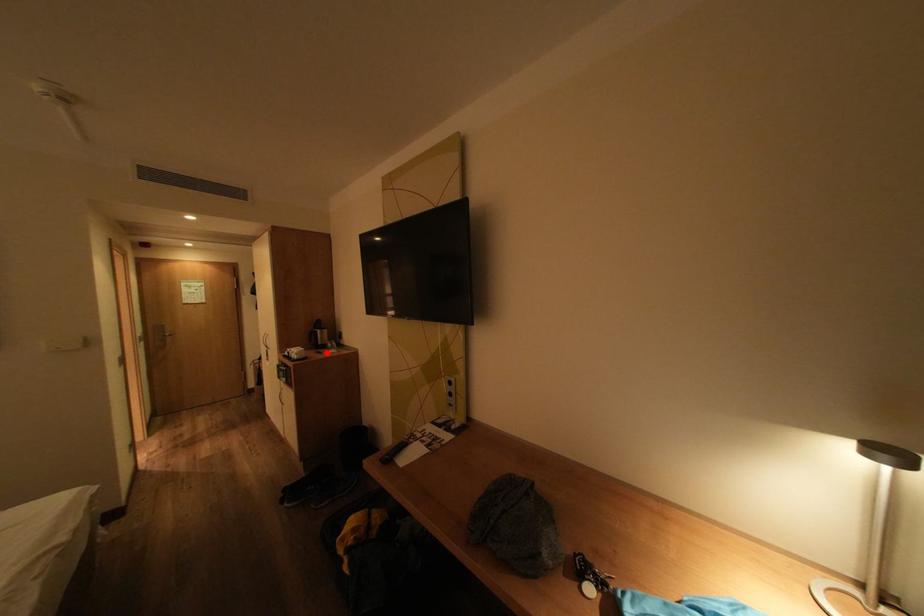
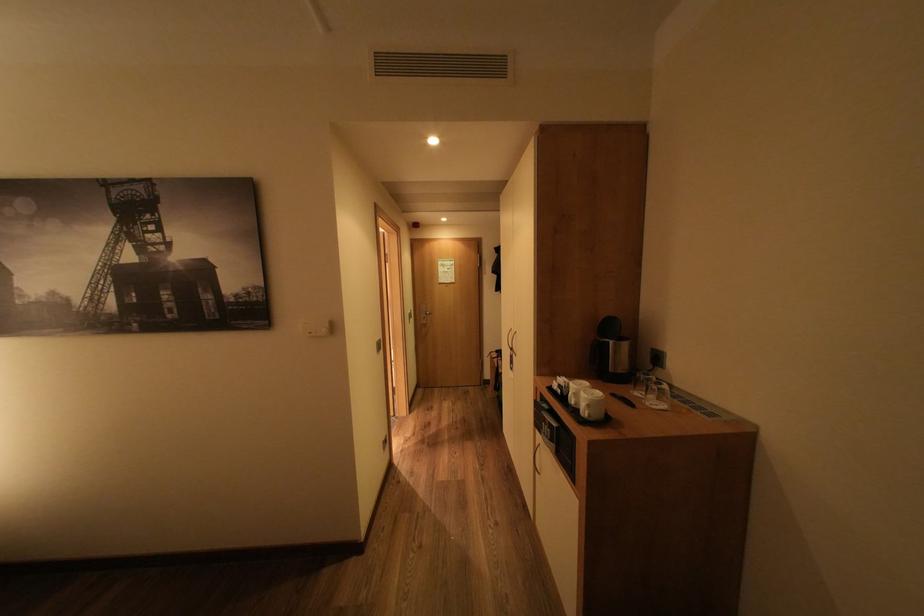
In the second image, find the point that corresponds to the highlighted location in the first image.

(624, 395)